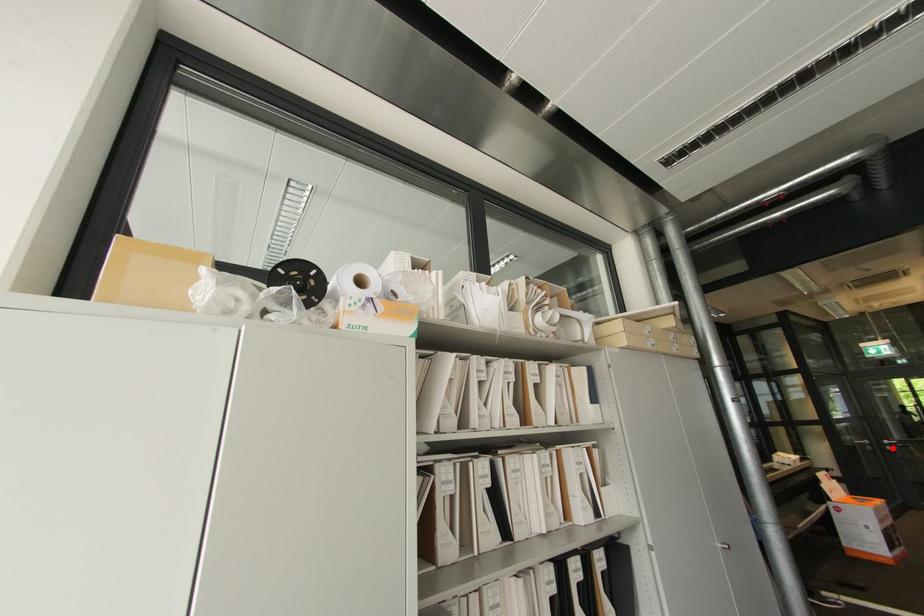
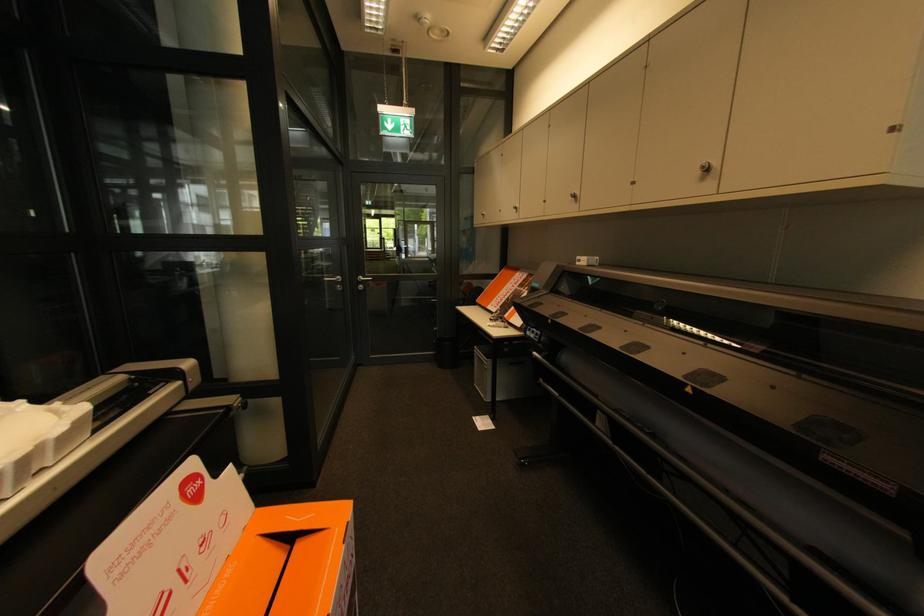
Find the pixel in the second image that matches the highlighted location in the first image.

(365, 286)